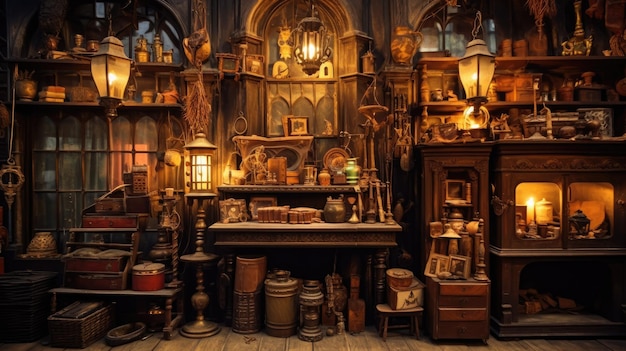
Locate an element on the screen. The image size is (626, 351). table is located at coordinates (138, 292), (114, 231).